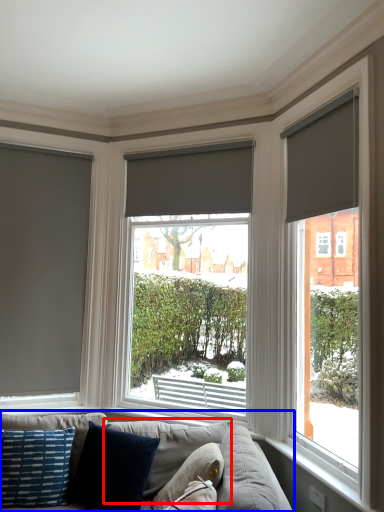
Question: Which point is further to the camera, pillow (highlighted by a red box) or studio couch (highlighted by a blue box)?

Choices:
 (A) pillow
 (B) studio couch

Answer: (B)